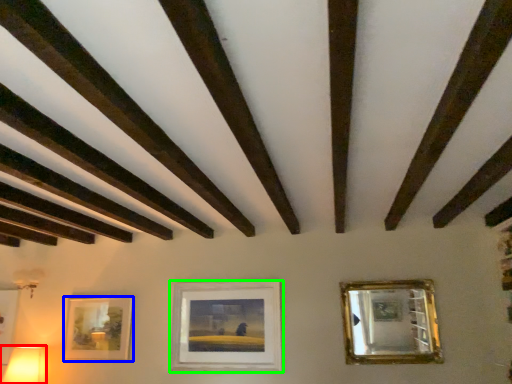
Question: Based on their relative distances, which object is nearer to table lamp (highlighted by a red box)? Choose from picture frame (highlighted by a blue box) and picture frame (highlighted by a green box).

Choices:
 (A) picture frame
 (B) picture frame

Answer: (A)